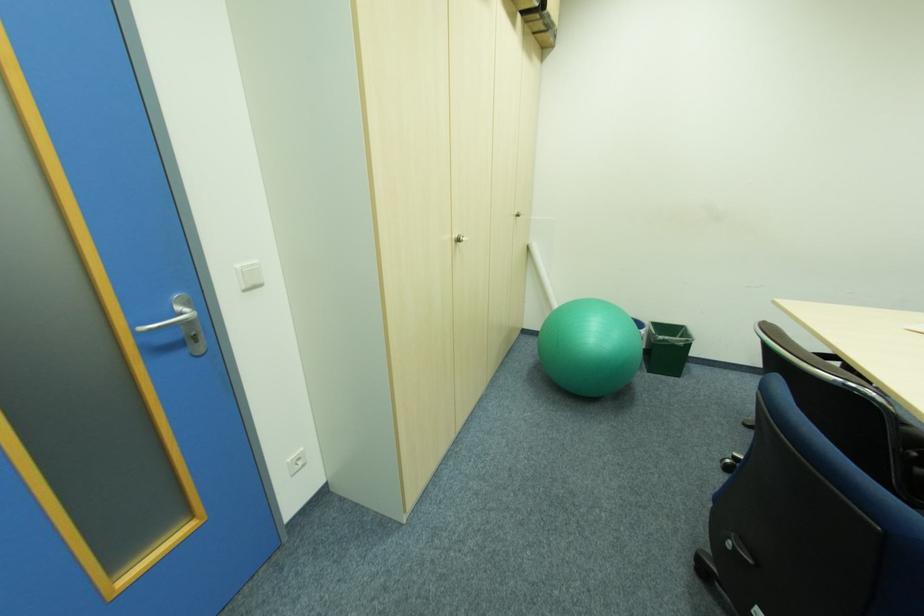
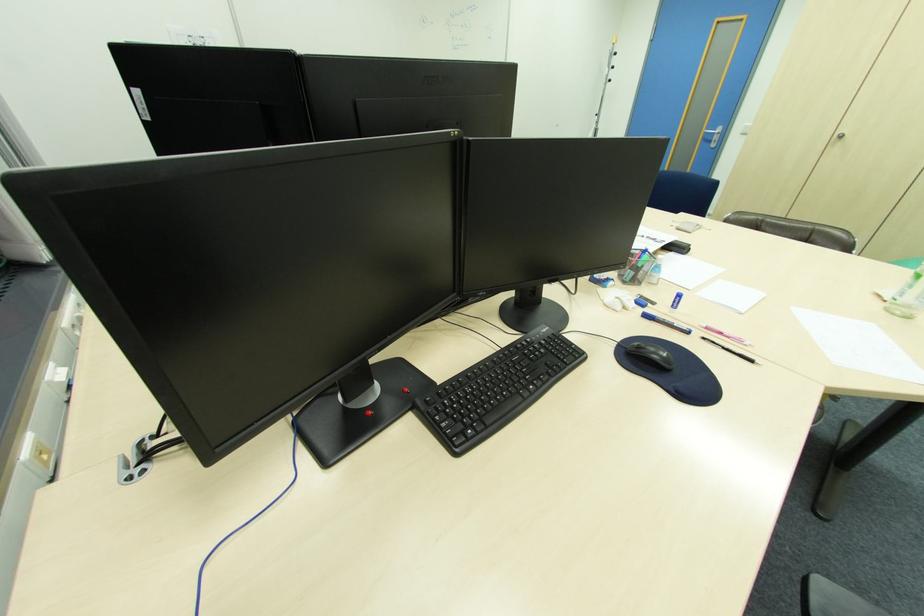
Find the pixel in the second image that matches the point at 171,341 in the first image.

(713, 139)